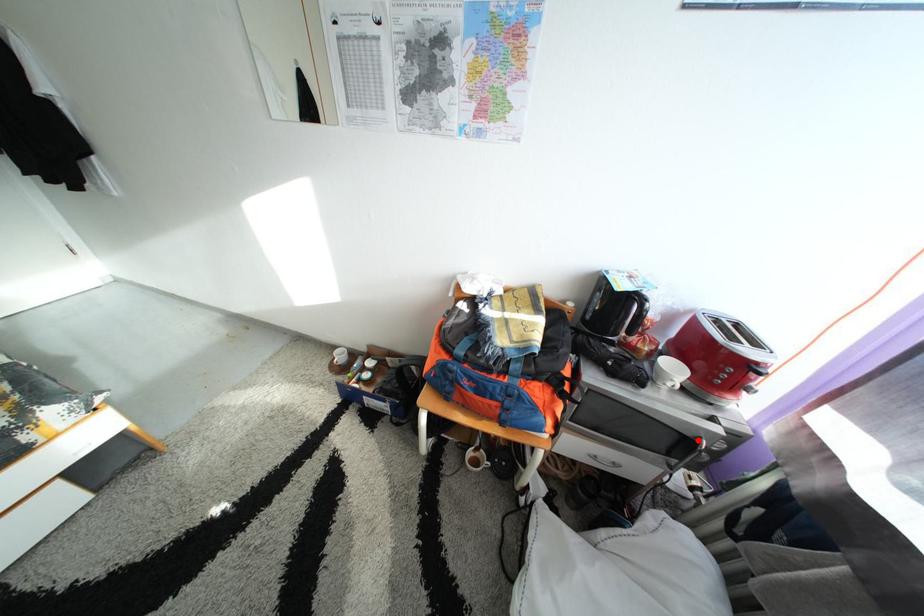
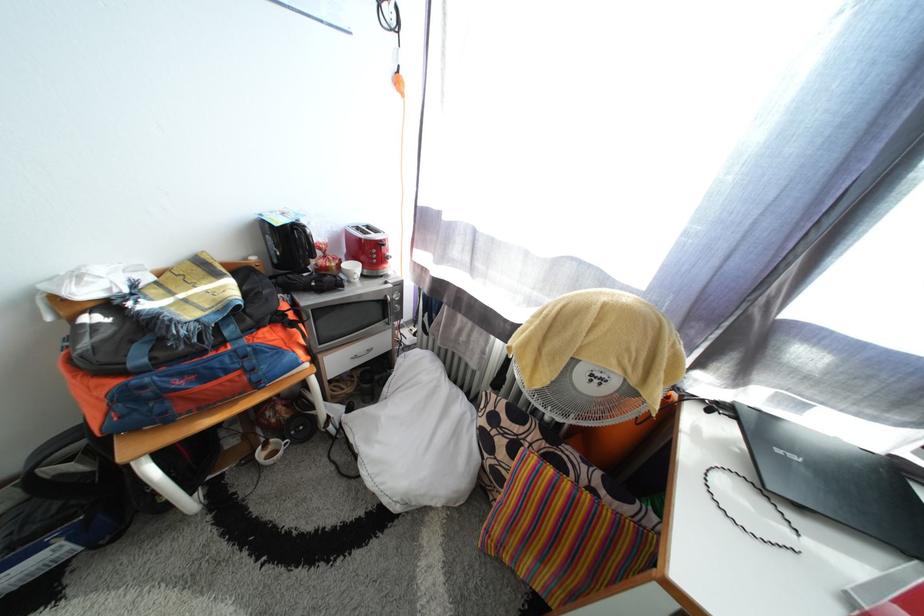
In the second image, find the point that corresponds to the highlighted location in the first image.

(390, 304)